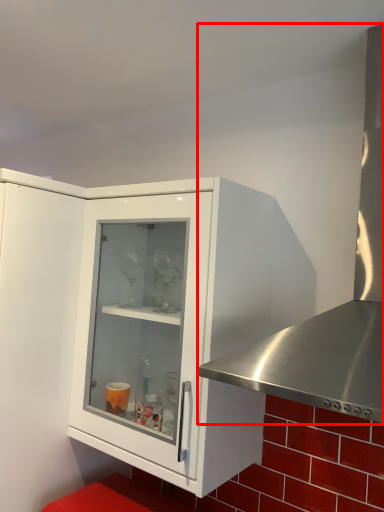
Question: From the image, what is the correct spatial relationship of kitchen appliance (annotated by the red box) in relation to cabinetry?

Choices:
 (A) left
 (B) right

Answer: (B)